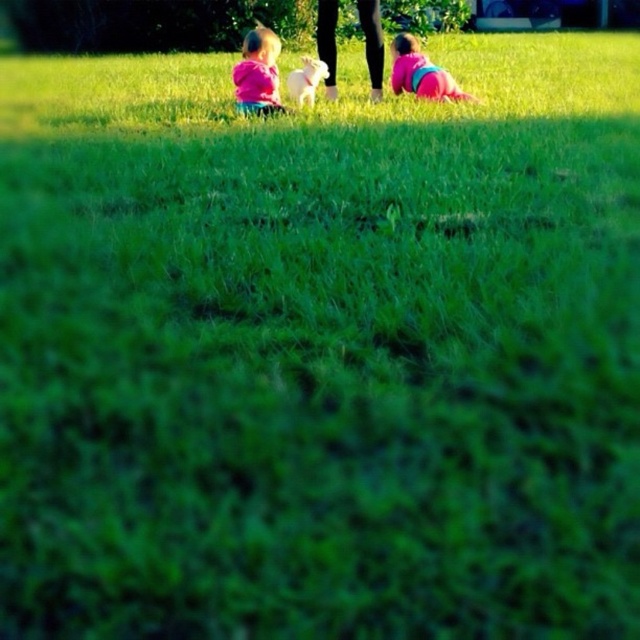
Is pink matte shirt at center above pink fabric baby at lower right?

No, pink matte shirt at center is not above pink fabric baby at lower right.

How far apart are pink matte shirt at center and pink fabric baby at lower right?

The distance of pink matte shirt at center from pink fabric baby at lower right is 76.62 centimeters.

Is point (241, 90) farther from camera compared to point (397, 61)?

No, (241, 90) is in front of (397, 61).

Find the location of a particular element. pink matte shirt at center is located at coordinates point(257,72).